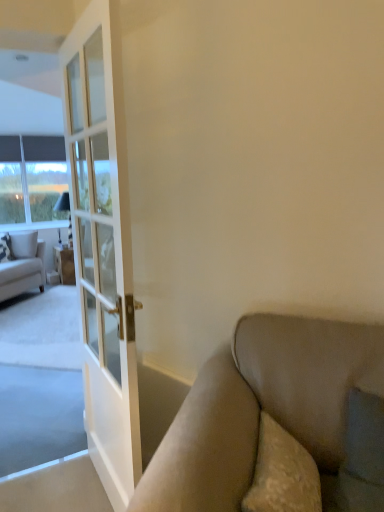
Describe the element at coordinates (23, 268) in the screenshot. I see `light beige fabric couch at left` at that location.

What is the approximate width of matte white cabinet at left?

23.43 inches.

Describe the element at coordinates (64, 264) in the screenshot. I see `matte white cabinet at left` at that location.

Find the location of a particular element. This screenshot has height=512, width=384. patterned fabric pillow at left, acting as the first pillow starting from the left is located at coordinates (6, 248).

Is light beige fabric couch at left with white textured pillow at left, which ranks as the 1th pillow in right-to-left order?

No, light beige fabric couch at left is not in contact with white textured pillow at left, which ranks as the 1th pillow in right-to-left order.

Can you confirm if light beige fabric couch at left is wider than white textured pillow at left, the 2th pillow from the left?

Yes.

Is light beige fabric couch at left at the left side of white textured pillow at left, the 2th pillow from the left?

Yes.

Is matte white cabinet at left surrounding light beige fabric couch at left?

Actually, light beige fabric couch at left is outside matte white cabinet at left.

Can you tell me how much matte white cabinet at left and light beige fabric couch at left differ in facing direction?

43.3 degrees.

Looking at this image, from the image's perspective, is matte white cabinet at left above or below light beige fabric couch at left?

Based on their image positions, matte white cabinet at left is located beneath light beige fabric couch at left.

From a real-world perspective, which object stands above the other?

light beige fabric couch at left, from a real-world perspective.

In the scene shown: Choose the correct answer: Is patterned fabric pillow at left, acting as the first pillow starting from the left, inside matte white cabinet at left or outside it?

patterned fabric pillow at left, acting as the first pillow starting from the left, is not inside matte white cabinet at left, it's outside.

Is patterned fabric pillow at left, acting as the first pillow starting from the left, taller or shorter than matte white cabinet at left?

patterned fabric pillow at left, acting as the first pillow starting from the left, is shorter than matte white cabinet at left.

Are patterned fabric pillow at left, acting as the first pillow starting from the left, and matte white cabinet at left beside each other?

No, patterned fabric pillow at left, acting as the first pillow starting from the left, is not beside matte white cabinet at left.

From the image's perspective, who appears lower, patterned fabric pillow at left, which is the second pillow in right-to-left order, or matte white cabinet at left?

matte white cabinet at left.

Is light beige fabric couch at left wider or thinner than matte white cabinet at left?

Considering their sizes, light beige fabric couch at left looks broader than matte white cabinet at left.

From the image's perspective, which object appears higher, light beige fabric couch at left or matte white cabinet at left?

light beige fabric couch at left.

Which object is closer to the camera taking this photo, light beige fabric couch at left or matte white cabinet at left?

light beige fabric couch at left is in front.

Can you confirm if light beige fabric couch at left is taller than matte white cabinet at left?

Yes, light beige fabric couch at left is taller than matte white cabinet at left.

From a real-world perspective, is white textured pillow at left, the 2th pillow from the left, positioned above or below matte white cabinet at left?

Clearly, from a real-world perspective, white textured pillow at left, the 2th pillow from the left, is above matte white cabinet at left.

Is white textured pillow at left, which ranks as the 1th pillow in right-to-left order, next to matte white cabinet at left?

No, white textured pillow at left, which ranks as the 1th pillow in right-to-left order, is not making contact with matte white cabinet at left.

Who is bigger, white textured pillow at left, the 2th pillow from the left, or matte white cabinet at left?

matte white cabinet at left is bigger.

Is white textured pillow at left, which ranks as the 1th pillow in right-to-left order, behind matte white cabinet at left?

No.

Based on the photo, is matte white cabinet at left not within clear glass window at left?

That's correct, matte white cabinet at left is outside of clear glass window at left.

Considering the sizes of objects matte white cabinet at left and clear glass window at left in the image provided, who is thinner, matte white cabinet at left or clear glass window at left?

clear glass window at left.

This screenshot has height=512, width=384. Find the location of `cabinetry that is under the clear glass window at left (from a real-world perspective)`. cabinetry that is under the clear glass window at left (from a real-world perspective) is located at coordinates (64, 264).

From the image's perspective, is matte white cabinet at left positioned above or below clear glass window at left?

matte white cabinet at left is situated lower than clear glass window at left in the image.

From the image's perspective, would you say matte white cabinet at left is shown under patterned fabric pillow at left, acting as the first pillow starting from the left?

Yes, from the image's perspective, matte white cabinet at left is beneath patterned fabric pillow at left, acting as the first pillow starting from the left.

Considering the relative sizes of matte white cabinet at left and patterned fabric pillow at left, which is the second pillow in right-to-left order, in the image provided, is matte white cabinet at left shorter than patterned fabric pillow at left, which is the second pillow in right-to-left order,?

In fact, matte white cabinet at left may be taller than patterned fabric pillow at left, which is the second pillow in right-to-left order.

Is there a large distance between matte white cabinet at left and patterned fabric pillow at left, which is the second pillow in right-to-left order?

No, matte white cabinet at left is not far away from patterned fabric pillow at left, which is the second pillow in right-to-left order.

How different are the orientations of matte white cabinet at left and patterned fabric pillow at left, which is the second pillow in right-to-left order, in degrees?

0.00183 degrees.

Locate an element on the screen. The height and width of the screenshot is (512, 384). studio couch below the white textured pillow at left, which ranks as the 1th pillow in right-to-left order (from the image's perspective) is located at coordinates (23, 268).

Find the location of a particular element. The height and width of the screenshot is (512, 384). studio couch above the matte white cabinet at left (from the image's perspective) is located at coordinates (23, 268).

When comparing their distances from patterned fabric pillow at left, acting as the first pillow starting from the left, does light beige fabric couch at left or clear glass window at left seem closer?

The object closer to patterned fabric pillow at left, acting as the first pillow starting from the left, is light beige fabric couch at left.

Based on their spatial positions, is clear glass window at left or patterned fabric pillow at left, acting as the first pillow starting from the left, further from matte white cabinet at left?

Based on the image, clear glass window at left appears to be further to matte white cabinet at left.

Based on their spatial positions, is patterned fabric pillow at left, which is the second pillow in right-to-left order, or white textured pillow at left, which ranks as the 1th pillow in right-to-left order, further from light beige fabric couch at left?

patterned fabric pillow at left, which is the second pillow in right-to-left order, is positioned further to the anchor light beige fabric couch at left.

Considering their positions, is matte white cabinet at left positioned further to light beige fabric couch at left than clear glass window at left?

clear glass window at left is positioned further to the anchor light beige fabric couch at left.

Looking at the image, which one is located closer to matte white cabinet at left, clear glass window at left or light beige fabric couch at left?

Among the two, light beige fabric couch at left is located nearer to matte white cabinet at left.

Consider the image. Which object lies further to the anchor point matte white cabinet at left, white textured pillow at left, which ranks as the 1th pillow in right-to-left order, or patterned fabric pillow at left, which is the second pillow in right-to-left order?

patterned fabric pillow at left, which is the second pillow in right-to-left order, is further to matte white cabinet at left.

From the picture: Considering their positions, is white textured pillow at left, which ranks as the 1th pillow in right-to-left order, positioned further to matte white cabinet at left than clear glass window at left?

Based on the image, clear glass window at left appears to be further to matte white cabinet at left.

When comparing their distances from clear glass window at left, does light beige fabric couch at left or matte white cabinet at left seem further?

matte white cabinet at left is further to clear glass window at left.

Where is `pillow positioned between patterned fabric pillow at left, acting as the first pillow starting from the left, and matte white cabinet at left from near to far`? This screenshot has width=384, height=512. pillow positioned between patterned fabric pillow at left, acting as the first pillow starting from the left, and matte white cabinet at left from near to far is located at coordinates pyautogui.click(x=24, y=244).

Where is `cabinetry between light beige fabric couch at left and clear glass window at left from front to back`? The height and width of the screenshot is (512, 384). cabinetry between light beige fabric couch at left and clear glass window at left from front to back is located at coordinates [64, 264].

Identify the location of pillow that lies between clear glass window at left and patterned fabric pillow at left, acting as the first pillow starting from the left, from top to bottom. This screenshot has width=384, height=512. (24, 244).

Find the location of a particular element. pillow located between light beige fabric couch at left and white textured pillow at left, the 2th pillow from the left, in the depth direction is located at coordinates (6, 248).